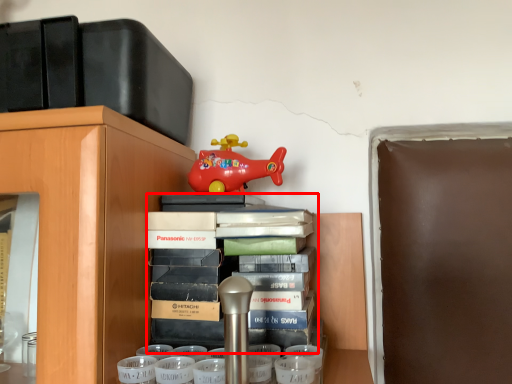
Question: In this image, where is book (annotated by the red box) located relative to toy?

Choices:
 (A) right
 (B) left

Answer: (A)